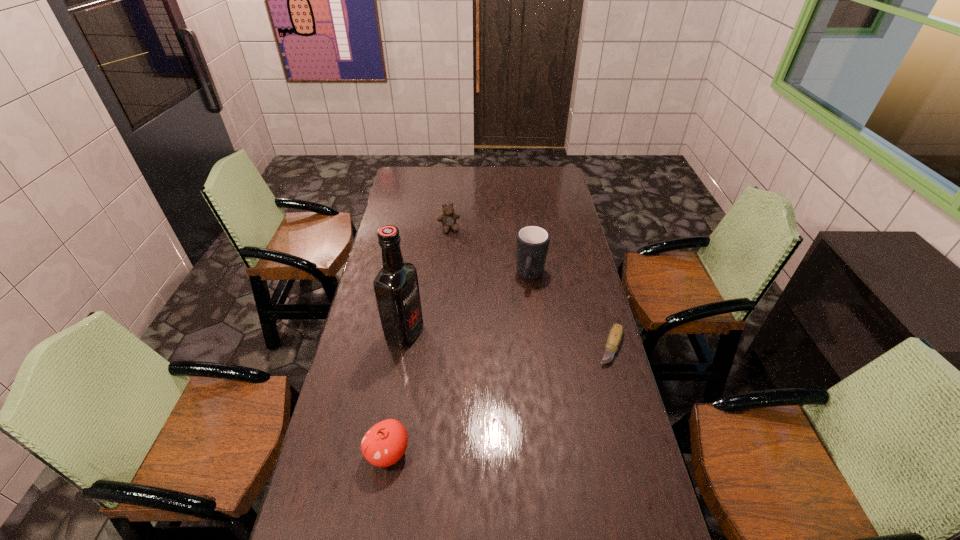
Image resolution: width=960 pixels, height=540 pixels. Find the location of `vacant area between the apple and the farthest object`. vacant area between the apple and the farthest object is located at coordinates (419, 341).

The image size is (960, 540). What are the coordinates of `vacant region between the rightmost object and the mug` in the screenshot? It's located at (571, 312).

Where is `free spot between the apple and the pocketknife`? free spot between the apple and the pocketknife is located at coordinates (499, 400).

Where is `free point between the tallest object and the teddy bear`? The height and width of the screenshot is (540, 960). free point between the tallest object and the teddy bear is located at coordinates (426, 281).

You are a GUI agent. You are given a task and a screenshot of the screen. Output one action in this format:
    pyautogui.click(x=<x>, y=<y>)
    Task: Click on the free space between the shortest object and the tallest object
    The width and height of the screenshot is (960, 540).
    Given the screenshot: What is the action you would take?
    pyautogui.click(x=508, y=340)

This screenshot has width=960, height=540. In order to click on free space between the tallest object and the pocketknife in this screenshot , I will do `click(508, 340)`.

Identify the location of vacant point located between the apple and the rightmost object. Image resolution: width=960 pixels, height=540 pixels. (499, 400).

This screenshot has height=540, width=960. I want to click on free space between the rightmost object and the teddy bear, so click(530, 288).

Locate which object ranks fourth in proximity to the fourth shortest object. Please provide its 2D coordinates. Your answer should be formatted as a tuple, i.e. [(x, y)], where the tuple contains the x and y coordinates of a point satisfying the conditions above.

[(385, 443)]

The height and width of the screenshot is (540, 960). In order to click on object that is the fourth closest to the second tallest object in this screenshot , I will do `click(385, 443)`.